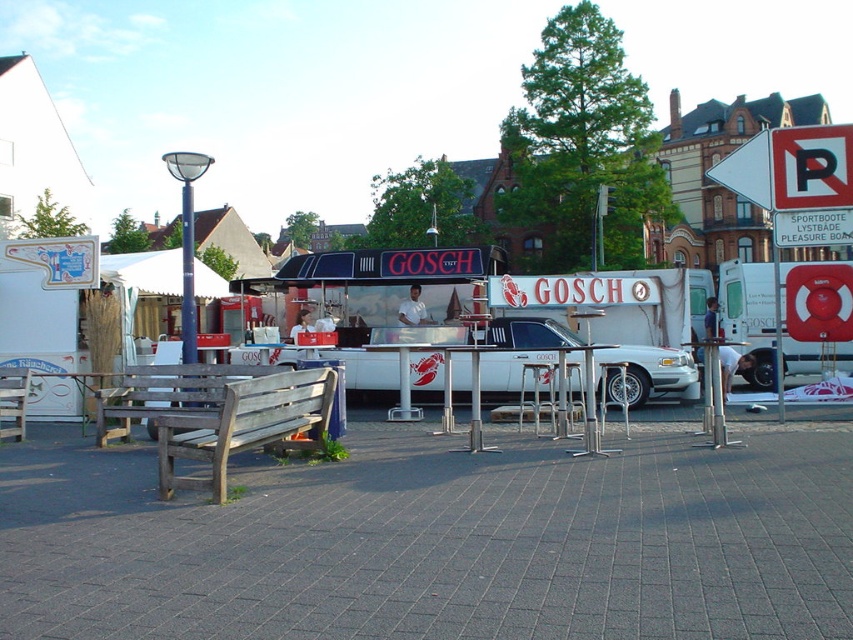
You are standing at the entrance of the market and want to find the GOSCH food stall. According to the map provided, the stall is marked at point (419,304). Can you confirm if the white glossy food truck at center is the correct location for the GOSCH stall?

Yes, the white glossy food truck at center is located at point (419,304), so it is the correct location for the GOSCH stall.

You are standing at the entrance of the market and see the point marked at coordinates (419, 304). What object is located at this point?

The point at coordinates (419, 304) marks the white glossy food truck at center.